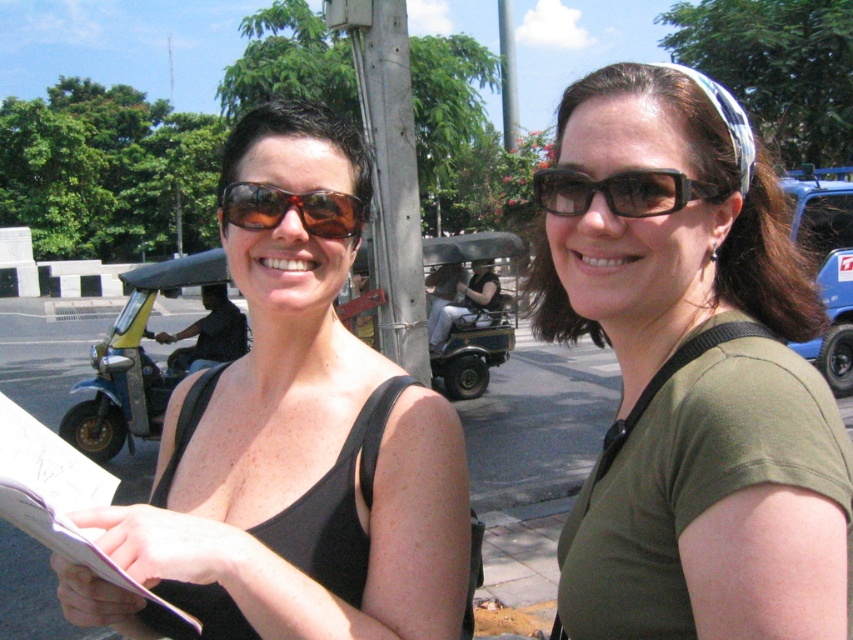
You are a photographer trying to capture the two people in the scene. You notice the green matte shirt at center and the black plastic sunglasses at upper center. Which object should you adjust your camera focus on first if you want to ensure both are in focus, considering their positions?

The black plastic sunglasses at upper center should be focused on first since it is closer to the camera than the green matte shirt at center, which is to its right. By focusing on the closer object, the depth of field may include both in focus.

You are a photographer standing at a point 33.32 inches away from the camera position. You need to capture a photo that includes both the person on the left wearing a black sleeveless top and the individual on the right in a green short sleeved shirt. Can you position yourself at the point marked at coordinates (x=688, y=476) to take this photo?

The point marked at coordinates (x=688, y=476) is 33.32 inches away from the camera. Since this position allows you to frame both the person on the left in the black sleeveless top and the individual on the right in the green short sleeved shirt, you can position yourself there to take the photo.